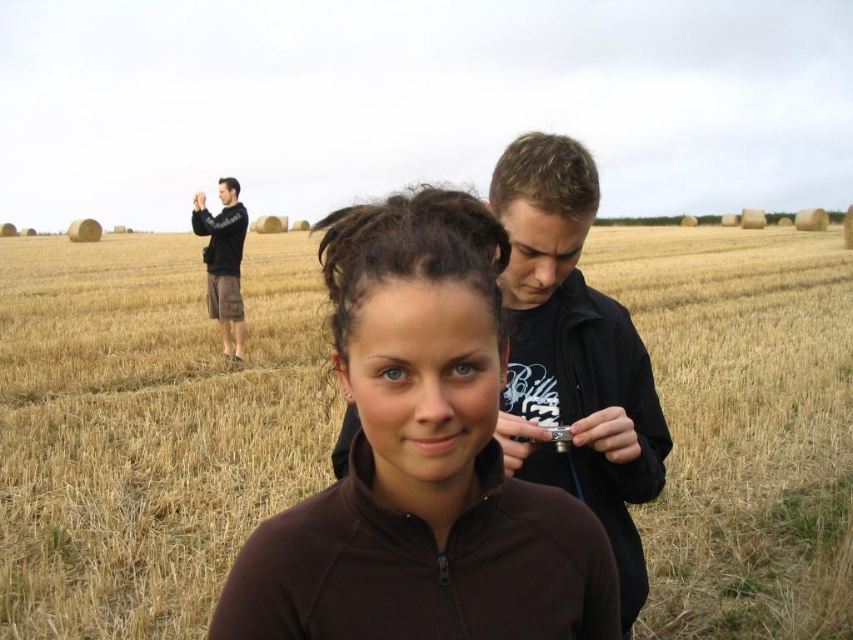
Looking at this image, you are a photographer trying to capture the black matte jacket at center and the yellow straw field at center in the same frame. Which object should you focus on first to ensure both are in focus?

You should focus on the black matte jacket at center first because it is closer to you than the yellow straw field at center, which is further away. By focusing on the closer object, you can ensure both are in focus using the depth of field.

You are a photographer trying to capture a group shot of the two people in the scene. Since you want to ensure everyone is in the frame, which jacket should you position to the right to make space for both the brown fleece jacket at center and the black matte jacket at center?

The brown fleece jacket at center is positioned on the left side of the black matte jacket at center. To make space for both, you should move the brown fleece jacket at center to the right so that it is no longer blocking the left side of the black matte jacket at center.

Looking at this image, you are a photographer trying to capture a shot of the woman in the foreground. You notice two jackets in the scene, the brown fleece jacket at center and the black matte jacket at center. Which jacket should you avoid blocking your camera view with, based on their positions?

The brown fleece jacket at center is located below the black matte jacket at center, so the black matte jacket at center is higher up and more likely to block the camera view. You should avoid blocking your camera view with the black matte jacket at center.